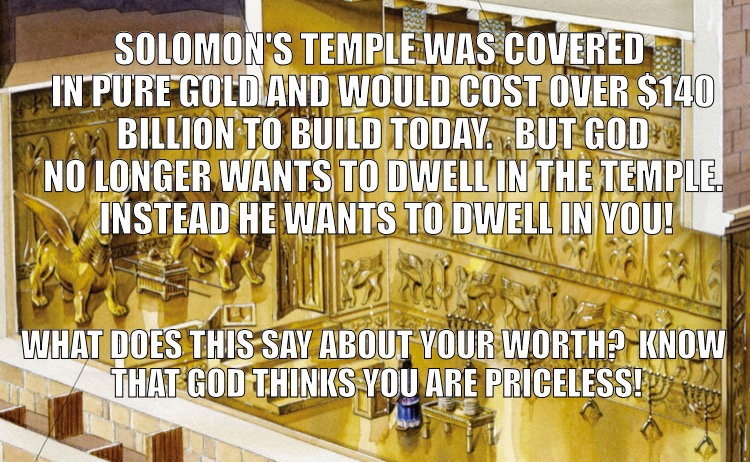
At what (x,y) coordinates should I click in order to perform the action: click on brick wall. Please return your answer as a coordinate pair (x, y). The image size is (750, 462). Looking at the image, I should click on (225, 456).